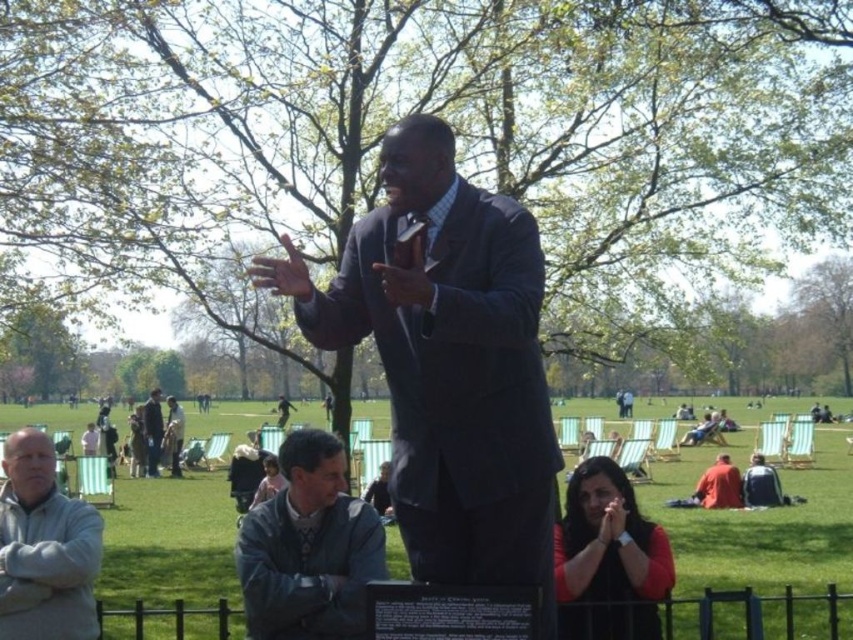
In the scene shown: Who is lower down, gray leather jacket at lower center or light gray fleece jacket at lower left?

gray leather jacket at lower center

Can you confirm if gray leather jacket at lower center is positioned to the right of light gray fleece jacket at lower left?

Indeed, gray leather jacket at lower center is positioned on the right side of light gray fleece jacket at lower left.

Between point (256, 547) and point (78, 605), which one is positioned in front?

Point (256, 547) is in front.

This screenshot has width=853, height=640. Find the location of `gray leather jacket at lower center`. gray leather jacket at lower center is located at coordinates (308, 547).

Is shiny black statue at center taller than light gray fleece jacket at lower left?

No.

Does shiny black statue at center have a smaller size compared to light gray fleece jacket at lower left?

Actually, shiny black statue at center might be larger than light gray fleece jacket at lower left.

Find the location of a particular element. shiny black statue at center is located at coordinates (759, 516).

Which is more to the left, dark blue suit at center or gray leather jacket at lower center?

Positioned to the left is gray leather jacket at lower center.

Is point (540, 452) positioned before point (376, 552)?

Yes, point (540, 452) is closer to viewer.

At what (x,y) coordinates should I click in order to perform the action: click on dark blue suit at center. Please return your answer as a coordinate pair (x, y). The width and height of the screenshot is (853, 640). Looking at the image, I should click on (448, 362).